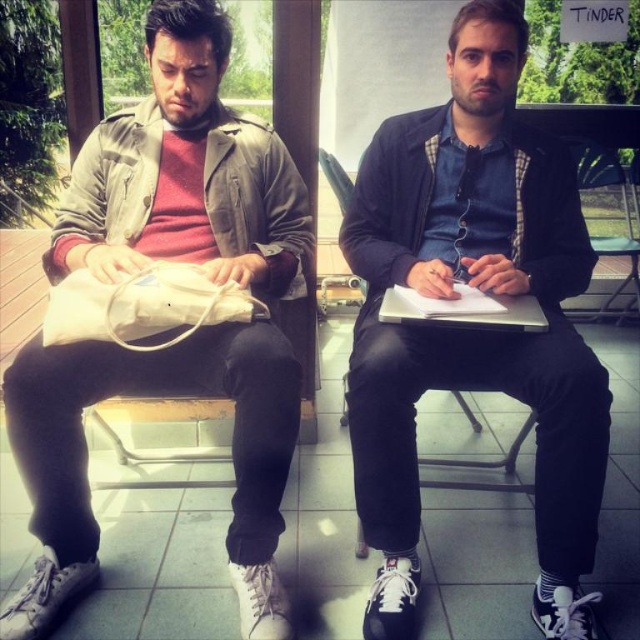
You are trying to reach the silver metallic laptop at center without moving the matte black jacket at center. Is this possible?

The matte black jacket at center is in front of the silver metallic laptop at center, so you cannot reach the laptop without moving the jacket.

You are trying to decide whether to place a new item on the matte black jacket at center or on top of the silver metallic laptop at center. Based on their current positions, which object is located below the other?

The matte black jacket at center is positioned under the silver metallic laptop at center, so the matte black jacket is below the laptop.

You are a delivery person who needs to place a small package between the matte khaki jacket at center and the silver metallic laptop at center. Since the package is 10 cm in width, can you fit it there?

The matte khaki jacket at center is bigger than the silver metallic laptop at center. However, the exact space between them isn t specified. The package s width of 10 cm might fit if there s enough space between the two items. Without precise distance details, it s uncertain.